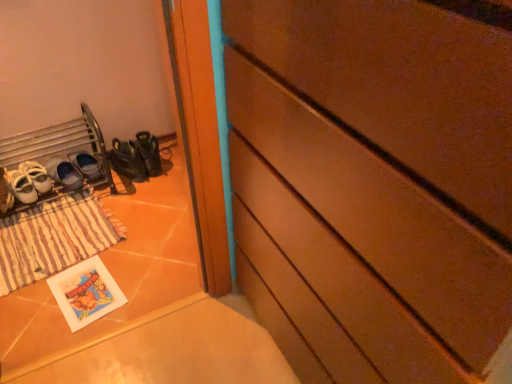
Identify the location of vacant space to the right of matte black shoes at lower left, which is counted as the 4th footwear, starting from the left. (164, 176).